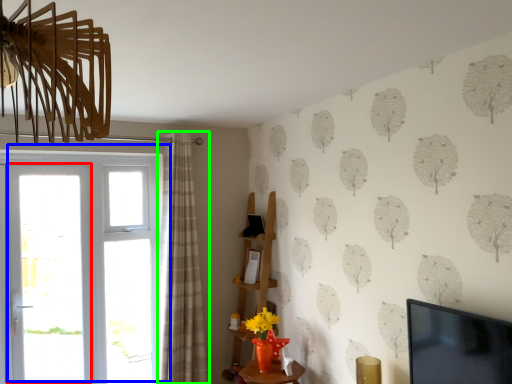
Question: Which is farther away from screen door (highlighted by a red box)? door (highlighted by a blue box) or curtain (highlighted by a green box)?

Choices:
 (A) door
 (B) curtain

Answer: (B)